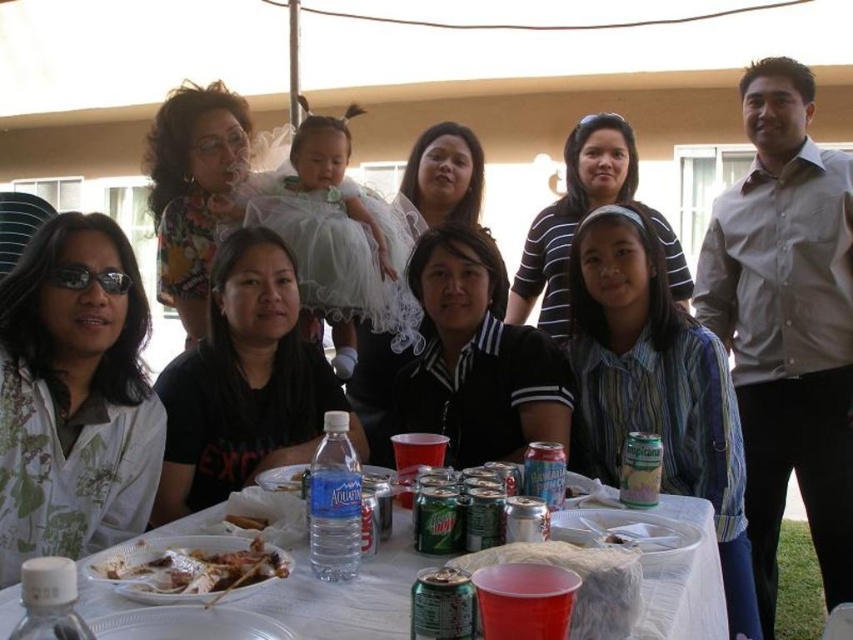
You are a food delivery robot with a 6 inch wide tray. You need to place a new dish between the grilled meat skewers at table center and the white crumbly bread at table center. Is there enough space for your tray?

The distance between the grilled meat skewers at table center and the white crumbly bread at table center is 8.11 inches. Since your tray is 6 inches wide, there is sufficient space to place it between them.

You are a guest at this event and want to grab a drink from the table. The white plastic table at center has drinks, but you notice the grilled meat skewers at table center might be in the way. Can you reach the drinks without moving the skewers?

The white plastic table at center is closer to the viewer than the grilled meat skewers at table center, so the skewers are further back on the table. You can reach the drinks near the edge of the table closest to you without disturbing the skewers.